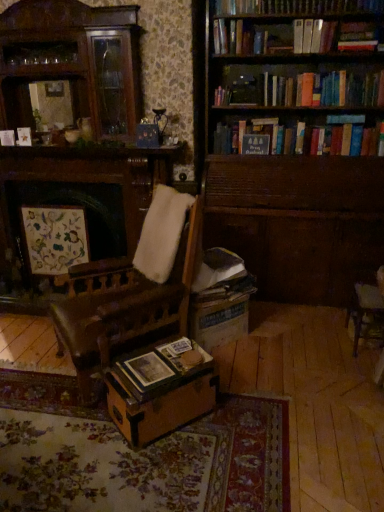
Describe the element at coordinates (313, 36) in the screenshot. This screenshot has height=512, width=384. I see `hardcover book at upper right, the first book viewed from the right` at that location.

What do you see at coordinates (292, 167) in the screenshot?
I see `wooden bookshelf at upper right` at bounding box center [292, 167].

Find the location of `wooden bookshelf at upper right`. wooden bookshelf at upper right is located at coordinates (292, 167).

Image resolution: width=384 pixels, height=512 pixels. What do you see at coordinates (162, 368) in the screenshot?
I see `wooden photo album at center, the first book positioned from the left` at bounding box center [162, 368].

What do you see at coordinates (222, 96) in the screenshot? I see `hardcover book at upper center, positioned as the second book in left-to-right order` at bounding box center [222, 96].

Measure the distance between point (171, 359) and camera.

Point (171, 359) is 6.92 feet from camera.

Locate an element on the screen. This screenshot has width=384, height=512. hardcover book at upper right, which appears as the second book when viewed from the back is located at coordinates (313, 36).

Considering the sizes of matte paper at center and wooden bookshelf at upper right in the image, is matte paper at center bigger or smaller than wooden bookshelf at upper right?

In the image, matte paper at center appears to be smaller than wooden bookshelf at upper right.

Is matte paper at center spatially inside wooden bookshelf at upper right, or outside of it?

matte paper at center is located beyond the bounds of wooden bookshelf at upper right.

Considering the sizes of objects matte paper at center and wooden bookshelf at upper right in the image provided, who is shorter, matte paper at center or wooden bookshelf at upper right?

Standing shorter between the two is matte paper at center.

From the image's perspective, which is above, matte paper at center or wooden bookshelf at upper right?

wooden bookshelf at upper right is shown above in the image.

Does point (50, 265) lie behind point (328, 30)?

Yes, point (50, 265) is behind point (328, 30).

Considering the sizes of matte floral artwork at left and hardcover book at upper right, which is counted as the second book, starting from the front, in the image, is matte floral artwork at left bigger or smaller than hardcover book at upper right, which is counted as the second book, starting from the front,?

matte floral artwork at left is bigger than hardcover book at upper right, which is counted as the second book, starting from the front.

Is matte floral artwork at left oriented towards hardcover book at upper right, the first book viewed from the right?

No, matte floral artwork at left is not turned towards hardcover book at upper right, the first book viewed from the right.

Can you confirm if matte floral artwork at left is taller than hardcover book at upper right, which appears as the second book when viewed from the back?

Correct, matte floral artwork at left is much taller as hardcover book at upper right, which appears as the second book when viewed from the back.

In the image, is matte paper at center on the left side or the right side of wooden chair at right?

From the image, it's evident that matte paper at center is to the left of wooden chair at right.

Could you tell me if matte paper at center is turned towards wooden chair at right?

No, matte paper at center is not aimed at wooden chair at right.

Does point (177, 358) appear closer or farther from the camera than point (359, 286)?

Point (177, 358) appears to be closer to the viewer than point (359, 286).

From a real-world perspective, who is located higher, wooden bookshelf at upper right or wooden photo album at center, the third book from the right?

wooden bookshelf at upper right is physically above.

Is wooden bookshelf at upper right not inside wooden photo album at center, the first book positioned from the left?

Absolutely, wooden bookshelf at upper right is external to wooden photo album at center, the first book positioned from the left.

Is wooden bookshelf at upper right not near wooden photo album at center, the third book from the right?

That's right, there is a large distance between wooden bookshelf at upper right and wooden photo album at center, the third book from the right.

Locate an element on the screen. The height and width of the screenshot is (512, 384). bookshelf above the wooden photo album at center, which ranks as the first book in front-to-back order (from the image's perspective) is located at coordinates 292,167.

Is point (70, 225) closer or farther from the camera than point (143, 376)?

Point (70, 225).

Does matte floral artwork at left come in front of wooden photo album at center, which ranks as the first book in front-to-back order?

No, the depth of matte floral artwork at left is greater than that of wooden photo album at center, which ranks as the first book in front-to-back order.

Could you tell me if matte floral artwork at left is turned towards wooden photo album at center, which ranks as the first book in front-to-back order?

No, matte floral artwork at left is not aimed at wooden photo album at center, which ranks as the first book in front-to-back order.

At what (x,y) coordinates should I click in order to perform the action: click on picture frame located above the wooden photo album at center, the first book positioned from the left (from the image's perspective). Please return your answer as a coordinate pair (x, y). This screenshot has width=384, height=512. Looking at the image, I should click on (55, 238).

Does hardcover book at upper center, which is the 1th book in back-to-front order, have a smaller size compared to wooden photo album at center, the third book from the right?

Yes.

Considering the sizes of objects hardcover book at upper center, marked as the second book in a top-to-bottom arrangement, and wooden photo album at center, the 1th book in the bottom-to-top sequence, in the image provided, who is shorter, hardcover book at upper center, marked as the second book in a top-to-bottom arrangement, or wooden photo album at center, the 1th book in the bottom-to-top sequence,?

wooden photo album at center, the 1th book in the bottom-to-top sequence, is shorter.

Is hardcover book at upper center, marked as the second book in a top-to-bottom arrangement, oriented towards wooden photo album at center, the first book positioned from the left?

No, hardcover book at upper center, marked as the second book in a top-to-bottom arrangement, does not turn towards wooden photo album at center, the first book positioned from the left.

Is wooden photo album at center, the first book positioned from the left, surrounded by hardcover book at upper center, which ranks as the second book in bottom-to-top order?

Actually, wooden photo album at center, the first book positioned from the left, is outside hardcover book at upper center, which ranks as the second book in bottom-to-top order.

Can you tell me how much hardcover book at upper right, marked as the 1th book in a top-to-bottom arrangement, and matte floral artwork at left differ in facing direction?

The angle between the facing direction of hardcover book at upper right, marked as the 1th book in a top-to-bottom arrangement, and the facing direction of matte floral artwork at left is 0.265 degrees.

Between hardcover book at upper right, marked as the 1th book in a top-to-bottom arrangement, and matte floral artwork at left, which one appears on the left side from the viewer's perspective?

matte floral artwork at left.

From the image's perspective, which book is the 2nd one above the matte floral artwork at left? Please provide its 2D coordinates.

[(313, 36)]

Which is more distant, (327, 37) or (66, 253)?

The point (66, 253) is more distant.

This screenshot has height=512, width=384. I want to click on paperback book located below the wooden bookshelf at upper right (from the image's perspective), so click(x=184, y=355).

Find the location of a particular element. The width and height of the screenshot is (384, 512). picture frame directly beneath the hardcover book at upper right, the third book positioned from the left (from a real-world perspective) is located at coordinates (55, 238).

From the image, which object appears to be nearer to matte floral artwork at left, wooden photo album at center, the first book positioned from the left, or wooden chair at right?

wooden photo album at center, the first book positioned from the left, is closer to matte floral artwork at left.

When comparing their distances from hardcover book at upper center, positioned as the second book in left-to-right order, does wooden bookshelf at upper right or wooden trunk at center seem further?

wooden trunk at center.

Based on the photo, estimate the real-world distances between objects in this image. Which object is further from hardcover book at upper right, the third book positioned from the left, matte paper at center or wooden chair at right?

Based on the image, matte paper at center appears to be further to hardcover book at upper right, the third book positioned from the left.

Based on the photo, which object lies nearer to the anchor point matte floral artwork at left, hardcover book at upper center, marked as the 2th book in a right-to-left arrangement, or wooden photo album at center, the third book from the right?

Among the two, wooden photo album at center, the third book from the right, is located nearer to matte floral artwork at left.

Consider the image. Looking at the image, which one is located further to wooden photo album at center, the third book from the right, hardcover book at upper center, which is the 1th book in back-to-front order, or hardcover book at upper right, the third book positioned from the left?

hardcover book at upper right, the third book positioned from the left, lies further to wooden photo album at center, the third book from the right, than the other object.

Which object lies further to the anchor point wooden chair at right, wooden trunk at center or hardcover book at upper center, marked as the 2th book in a right-to-left arrangement?

hardcover book at upper center, marked as the 2th book in a right-to-left arrangement, lies further to wooden chair at right than the other object.

When comparing their distances from wooden chair at right, does matte floral artwork at left or wooden trunk at center seem further?

Among the two, matte floral artwork at left is located further to wooden chair at right.

When comparing their distances from matte floral artwork at left, does hardcover book at upper center, marked as the 2th book in a right-to-left arrangement, or hardcover book at upper right, which is counted as the second book, starting from the front, seem further?

Among the two, hardcover book at upper right, which is counted as the second book, starting from the front, is located further to matte floral artwork at left.

Where is `paperback book between wooden photo album at center, arranged as the 3th book when viewed from the top, and wooden chair at right, in the horizontal direction`? paperback book between wooden photo album at center, arranged as the 3th book when viewed from the top, and wooden chair at right, in the horizontal direction is located at coordinates (184, 355).

Identify the location of chair between hardcover book at upper center, which appears as the third book when viewed from the front, and wooden trunk at center from top to bottom. (367, 310).

This screenshot has height=512, width=384. What are the coordinates of `paperback book that lies between wooden bookshelf at upper right and wooden photo album at center, which ranks as the first book in front-to-back order, from top to bottom` in the screenshot? It's located at [184, 355].

Image resolution: width=384 pixels, height=512 pixels. I want to click on bookshelf between hardcover book at upper center, which ranks as the second book in bottom-to-top order, and wooden trunk at center in the up-down direction, so click(x=292, y=167).